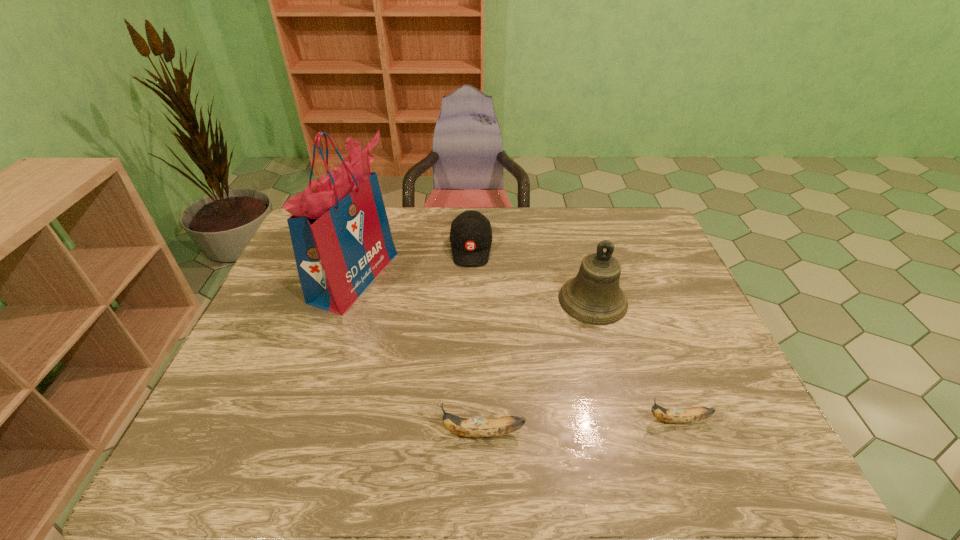
Locate an element on the screen. Image resolution: width=960 pixels, height=540 pixels. free space that is in between the left banana and the baseball cap is located at coordinates (477, 340).

This screenshot has width=960, height=540. Identify the location of vacant space that's between the grocery bag and the baseball cap. (413, 262).

Find the location of `vacant area that lies between the bell and the left banana`. vacant area that lies between the bell and the left banana is located at coordinates (538, 367).

This screenshot has width=960, height=540. Identify the location of free space that is in between the baseball cap and the tallest object. (413, 262).

Locate an element on the screen. free area in between the tallest object and the left banana is located at coordinates (419, 355).

Locate an element on the screen. The width and height of the screenshot is (960, 540). free point between the bell and the baseball cap is located at coordinates (532, 274).

Locate an element on the screen. This screenshot has height=540, width=960. free space between the shorter banana and the taller banana is located at coordinates (580, 426).

At what (x,y) coordinates should I click in order to perform the action: click on blank region between the tallest object and the baseball cap. Please return your answer as a coordinate pair (x, y). This screenshot has height=540, width=960. Looking at the image, I should click on (413, 262).

This screenshot has height=540, width=960. Identify the location of free space that is in between the taller banana and the fourth shortest object. (538, 367).

I want to click on object that is the third closest to the right banana, so click(x=471, y=234).